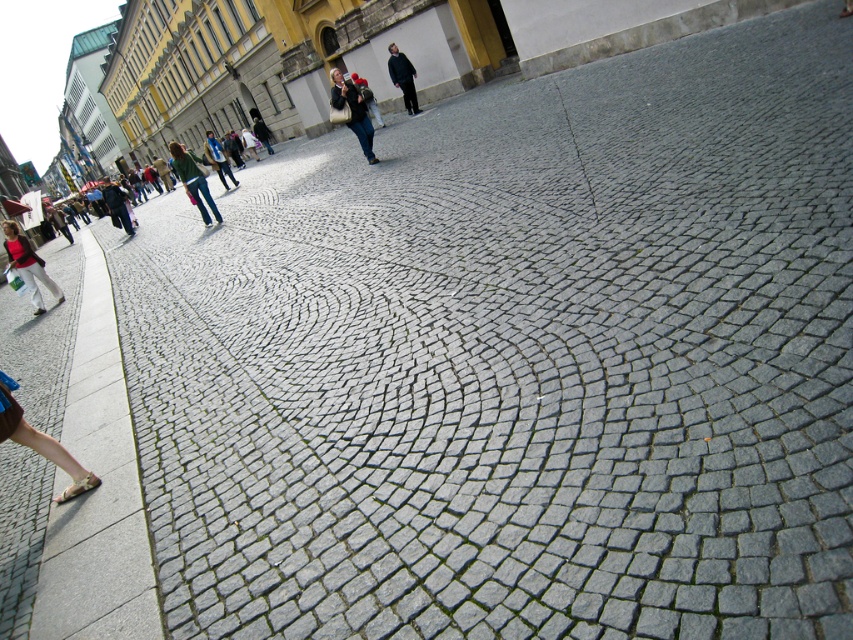
You are a photographer trying to capture a detailed shot of both the matte black jacket at center and the light brown leather sandal at lower left in the same frame. Given that your camera can only focus on objects within a 1.5 meter width, will both objects fit in the frame if you adjust your position to include both?

The matte black jacket at center is wider than the light brown leather sandal at lower left. However, since the camera can focus on objects within a 1.5 meter width, both objects can fit in the frame as long as their combined widths do not exceed 1.5 meters. The exact answer depends on their individual widths, but since the jacket is wider, you may need to position yourself to ensure both fit within the frame.

You are a photographer trying to capture both the green fabric jacket at center and the dark gray fabric jacket at center in a single frame. Since they are both at the center, which jacket will appear bigger in your photo?

The green fabric jacket at center will appear bigger in the photo because it is larger in size than the dark gray fabric jacket at center.

In the scene shown: You are standing at the point marked by the coordinates point (352, 112), which is where the matte black jacket at center is located. If you want to cross the street to the other side, which direction should you walk to reach the opposite side of the cobblestone street?

You should walk towards the direction away from the matte black jacket at center along the cobblestone street to reach the opposite side.